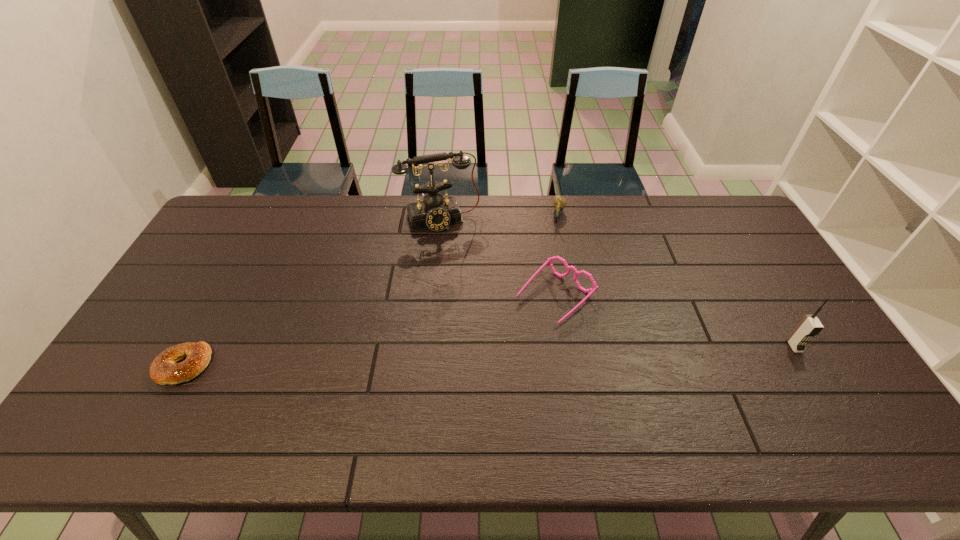
You are a GUI agent. You are given a task and a screenshot of the screen. Output one action in this format:
    pyautogui.click(x=<x>, y=<y>)
    Task: Click on the leftmost object
    
    Given the screenshot: What is the action you would take?
    pyautogui.click(x=164, y=370)

The height and width of the screenshot is (540, 960). In order to click on bagel in this screenshot , I will do `click(164, 370)`.

Where is `cellular telephone`? Image resolution: width=960 pixels, height=540 pixels. cellular telephone is located at coordinates (810, 325).

The image size is (960, 540). In order to click on the rightmost object in this screenshot , I will do `click(810, 325)`.

Locate an element on the screen. The image size is (960, 540). spectacles is located at coordinates (549, 260).

I want to click on the fourth object from right to left, so click(x=436, y=213).

You are a GUI agent. You are given a task and a screenshot of the screen. Output one action in this format:
    pyautogui.click(x=<x>, y=<y>)
    Task: Click on the telephone
    This screenshot has width=960, height=540.
    Given the screenshot: What is the action you would take?
    point(436,213)

At what (x,y) coordinates should I click in order to perform the action: click on the second shortest object. Please return your answer as a coordinate pair (x, y). This screenshot has width=960, height=540. Looking at the image, I should click on (559, 202).

Identify the location of free location located 0.300m on the back of the leftmost object. The width and height of the screenshot is (960, 540). (237, 267).

The height and width of the screenshot is (540, 960). What are the coordinates of `vacant space located on the front-facing side of the second tallest object` in the screenshot? It's located at (829, 405).